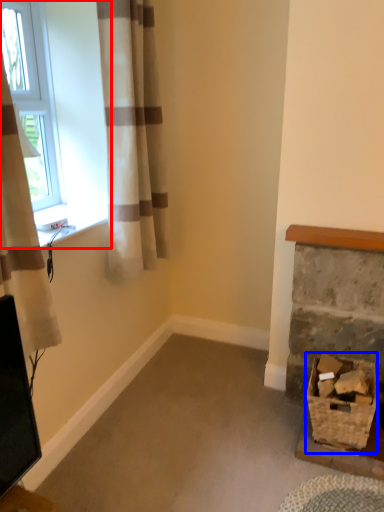
Question: Which object appears farthest to the camera in this image, window (highlighted by a red box) or basket (highlighted by a blue box)?

Choices:
 (A) window
 (B) basket

Answer: (A)